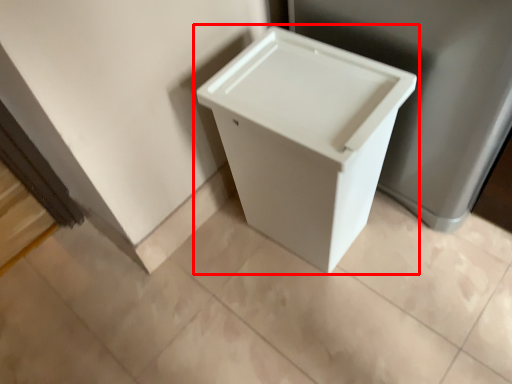
Question: From the image's perspective, considering the relative positions of waste container (annotated by the red box) and porcelain in the image provided, where is waste container (annotated by the red box) located with respect to the staircase?

Choices:
 (A) above
 (B) below

Answer: (B)